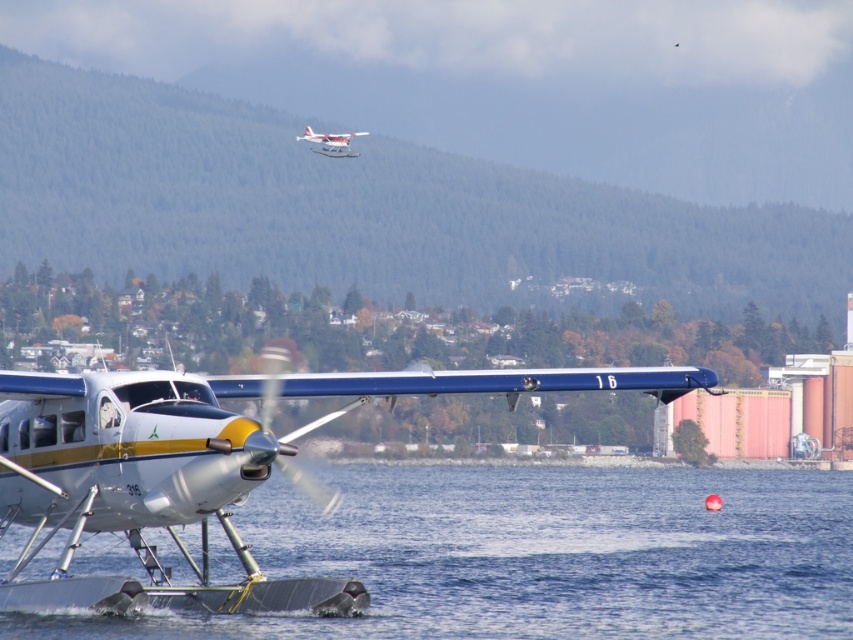
You are a drone operator trying to capture a photo of the seaplanes from above. You notice the white matte water at lower center is crucial for the reflection in the image. Where exactly is the white matte water located in the scene?

The white matte water at lower center is located at point coordinates of 0.869 on the x axis and 0.635 on the y axis.

You are standing at the edge of the water and see two points marked in the scene. Which point, point (28, 428) or point (317, 150), is closer to you?

Point (28, 428) is closer to the viewer than point (317, 150).